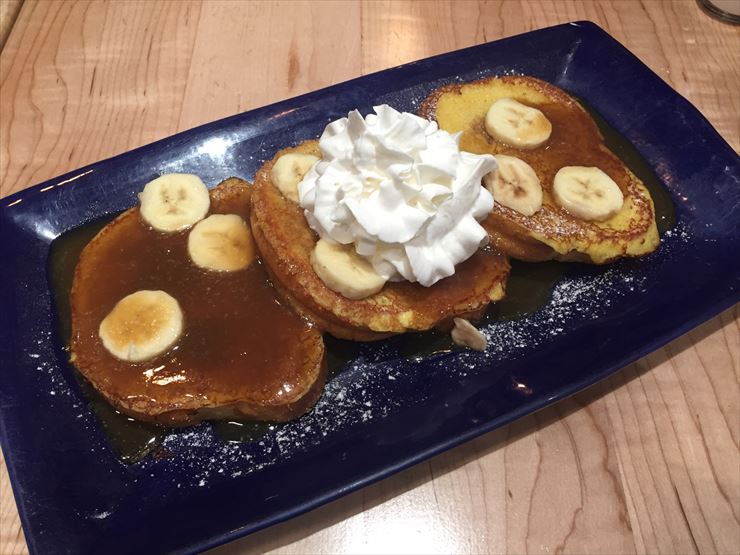
Locate an element on the screen. corner is located at coordinates (581, 17).